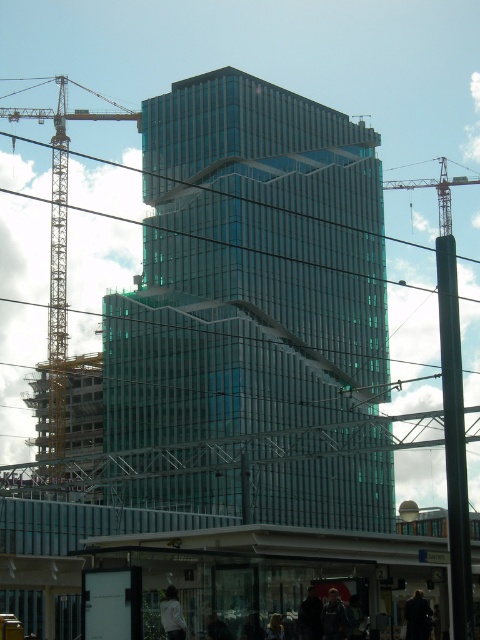
Question: In this image, where is metallic yellow crane at left located relative to white matte jacket at lower center?

Choices:
 (A) above
 (B) below

Answer: (A)

Question: Considering the relative positions of metallic yellow crane at left and dark blue fabric jacket at center in the image provided, where is metallic yellow crane at left located with respect to dark blue fabric jacket at center?

Choices:
 (A) below
 (B) above

Answer: (B)

Question: Which point is closer to the camera?

Choices:
 (A) (328, 132)
 (B) (408, 602)
 (C) (60, 168)

Answer: (B)

Question: Does transparent glass building at center appear under dark blue jacket at lower center?

Choices:
 (A) yes
 (B) no

Answer: (B)

Question: Which of the following is the farthest from the observer?

Choices:
 (A) (333, 312)
 (B) (62, 288)
 (C) (427, 614)
 (D) (345, 609)

Answer: (B)

Question: Which point is closer to the camera?

Choices:
 (A) white matte jacket at lower center
 (B) dark blue fabric jacket at center
 (C) metallic gray crane at upper right
 (D) transparent glass building at center

Answer: (A)